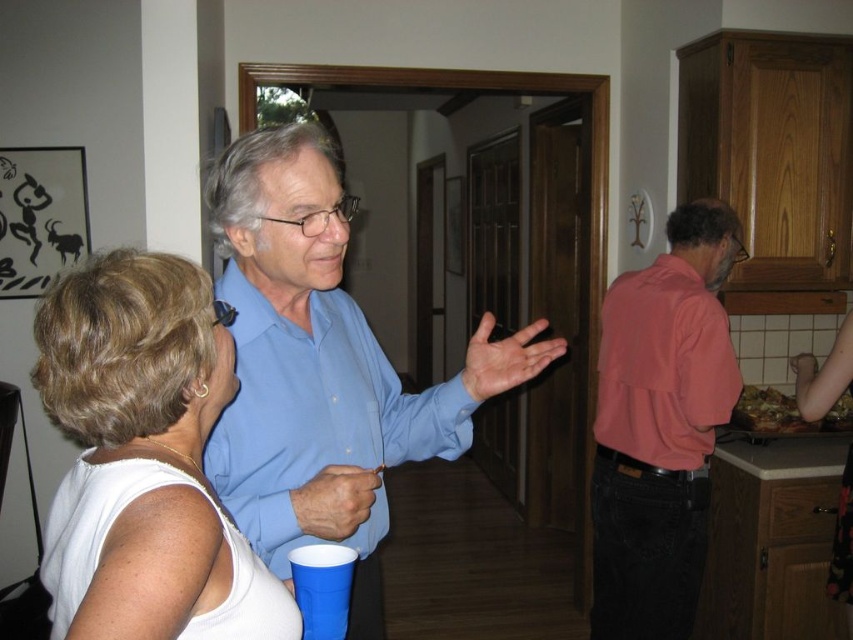
You are at the center of the room and want to hand a drink to the person wearing the blue smooth shirt at center. In which direction should you move to reach them?

The blue smooth shirt at center is located at point (323, 368), so you should move towards the lower right direction to reach them.

You are at a party and need to grab your blue plastic cup at lower center. You are currently holding a blue smooth shirt at center. Can you reach the cup without letting go of the shirt?

The blue smooth shirt at center and blue plastic cup at lower center are 26.94 centimeters apart. Since the distance is manageable, you can likely reach the cup while holding the shirt.

You are at the party and want to hand out a gift to both the blue smooth shirt at center and the pink cotton shirt at right. If you want to place the gifts on the ground so both can reach them easily, where should you put them?

The blue smooth shirt at center is shorter than the pink cotton shirt at right, so you should place the gifts on the ground between them at a spot where both can reach comfortably, considering their heights.